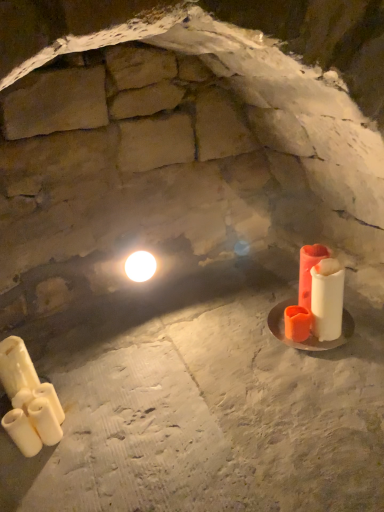
Question: From the image's perspective, is white matte candle at lower left, placed as the 3th candle when sorted from left to right, located above white matte candle at lower left, the fourth candle from the left?

Choices:
 (A) no
 (B) yes

Answer: (B)

Question: Is white matte candle at lower left, placed as the 3th candle when sorted from left to right, at the left side of white matte candle at lower left, positioned as the second candle in right-to-left order?

Choices:
 (A) yes
 (B) no

Answer: (A)

Question: Does white matte candle at lower left, which is the 3th candle in right-to-left order, lie in front of white matte candle at lower left, positioned as the second candle in right-to-left order?

Choices:
 (A) no
 (B) yes

Answer: (A)

Question: Would you say white matte candle at lower left, which is the 3th candle in right-to-left order, contains white matte candle at lower left, the fourth candle from the left?

Choices:
 (A) no
 (B) yes

Answer: (A)

Question: From a real-world perspective, is white matte candle at lower left, placed as the 3th candle when sorted from left to right, over white matte candle at lower left, positioned as the second candle in right-to-left order?

Choices:
 (A) yes
 (B) no

Answer: (B)

Question: Does white matte candle at lower left, which is the 3th candle in right-to-left order, have a larger size compared to white matte candle at lower left, positioned as the second candle in right-to-left order?

Choices:
 (A) yes
 (B) no

Answer: (A)

Question: Are white matte candle at lower left, which is counted as the 5th candle, starting from the right, and matte orange candle at right, acting as the 5th candle starting from the left, located far from each other?

Choices:
 (A) no
 (B) yes

Answer: (A)

Question: Is white matte candle at lower left, the 1th candle positioned from the left, next to matte orange candle at right, acting as the 5th candle starting from the left, and touching it?

Choices:
 (A) yes
 (B) no

Answer: (B)

Question: Considering the relative sizes of white matte candle at lower left, which is counted as the 5th candle, starting from the right, and matte orange candle at right, acting as the 5th candle starting from the left, in the image provided, is white matte candle at lower left, which is counted as the 5th candle, starting from the right, bigger than matte orange candle at right, acting as the 5th candle starting from the left,?

Choices:
 (A) yes
 (B) no

Answer: (B)

Question: Could matte orange candle at right, acting as the 5th candle starting from the left, be considered to be inside white matte candle at lower left, the 1th candle positioned from the left?

Choices:
 (A) no
 (B) yes

Answer: (A)

Question: Can you confirm if white matte candle at lower left, which is counted as the 5th candle, starting from the right, is positioned to the left of matte orange candle at right, acting as the 5th candle starting from the left?

Choices:
 (A) yes
 (B) no

Answer: (A)

Question: Could you tell me if white matte candle at lower left, the 1th candle positioned from the left, is turned towards matte orange candle at right, acting as the 5th candle starting from the left?

Choices:
 (A) yes
 (B) no

Answer: (B)

Question: Can you confirm if white matte candle at lower left, positioned as the second candle in right-to-left order, is positioned to the right of white glossy light bulb at upper center?

Choices:
 (A) yes
 (B) no

Answer: (B)